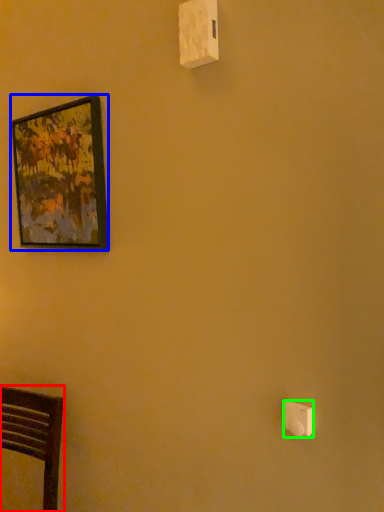
Question: Which is farther away from furniture (highlighted by a red box)? picture frame (highlighted by a blue box) or light switch (highlighted by a green box)?

Choices:
 (A) picture frame
 (B) light switch

Answer: (B)